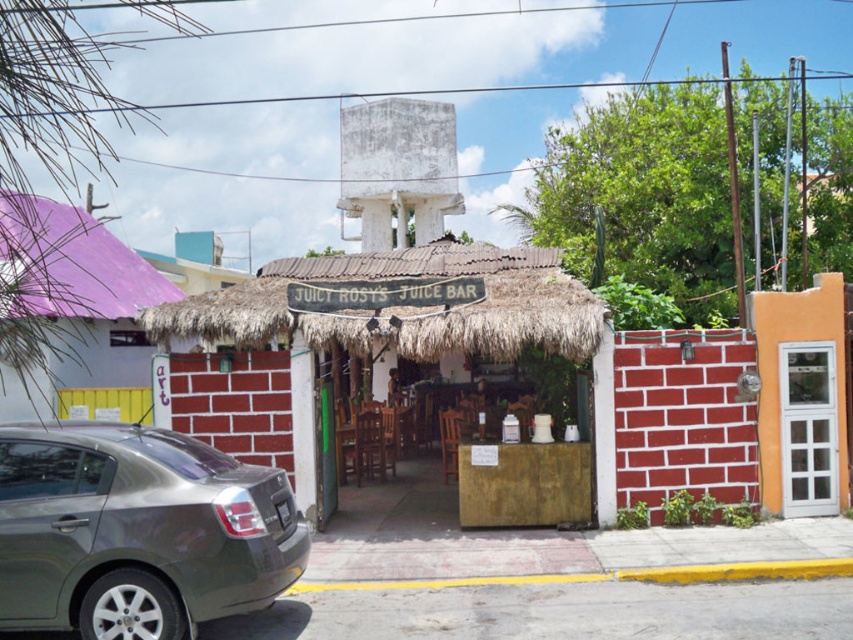
Who is positioned more to the left, thatched straw hut at center or matte purple thatched roof hut at left?

matte purple thatched roof hut at left

Who is positioned more to the right, thatched straw hut at center or matte purple thatched roof hut at left?

thatched straw hut at center

Image resolution: width=853 pixels, height=640 pixels. Identify the location of thatched straw hut at center. (393, 314).

Is the position of metallic gray sedan at lower left less distant than that of thatched straw hut at center?

Yes.

Is point (231, 502) behind point (247, 320)?

No, (231, 502) is closer to viewer.

In order to click on metallic gray sedan at lower left in this screenshot , I will do `click(137, 531)`.

Looking at this image, between thatched straw hut at center and white glass door at center, which one appears on the right side from the viewer's perspective?

white glass door at center

Is point (329, 273) positioned after point (795, 497)?

That is True.

This screenshot has height=640, width=853. I want to click on thatched straw hut at center, so click(x=393, y=314).

This screenshot has width=853, height=640. What are the coordinates of `thatched straw hut at center` in the screenshot? It's located at (393, 314).